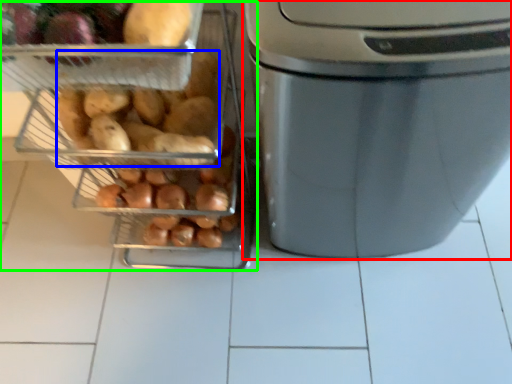
Question: Which object is the closest to the home appliance (highlighted by a red box)? Choose among these: sweet potato (highlighted by a blue box) or appliance (highlighted by a green box).

Choices:
 (A) sweet potato
 (B) appliance

Answer: (B)